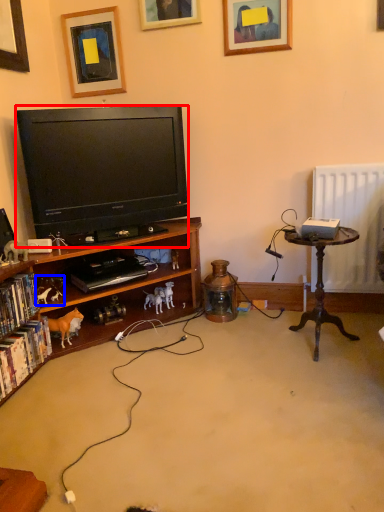
Question: Which of the following is the closest to the observer, television (highlighted by a red box) or toy (highlighted by a blue box)?

Choices:
 (A) television
 (B) toy

Answer: (A)